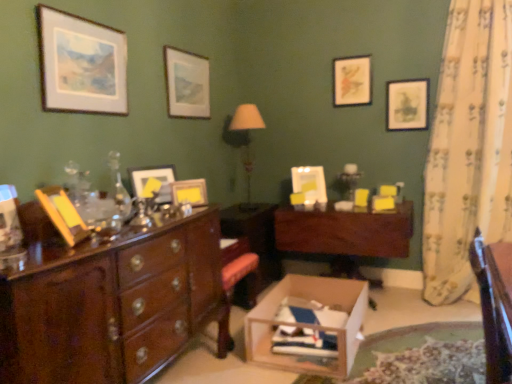
Question: From a real-world perspective, is mahogany wood desk at center positioned above or below matte gold picture frame at center, which is the fourth picture frame in left-to-right order?

Choices:
 (A) below
 (B) above

Answer: (A)

Question: Considering the positions of mahogany wood desk at center and matte gold picture frame at center, the second picture frame in the front-to-back sequence, in the image, is mahogany wood desk at center wider or thinner than matte gold picture frame at center, the second picture frame in the front-to-back sequence,?

Choices:
 (A) thin
 (B) wide

Answer: (B)

Question: Which object is positioned closest to the matte gold picture frame at center, the second picture frame in the front-to-back sequence?

Choices:
 (A) mahogany wood desk at center
 (B) matte black picture frame at upper right, positioned as the 6th picture frame in left-to-right order
 (C) wooden cardboard box at center
 (D) matte white picture frame at upper left, which is counted as the 6th picture frame, starting from the back
 (E) white floral fabric curtain at right

Answer: (D)

Question: Based on their relative distances, which object is nearer to the matte white picture frame at upper left, which appears as the first picture frame when viewed from the front?

Choices:
 (A) mahogany wood desk at center
 (B) white fabric lampshade at center
 (C) wooden cardboard box at center
 (D) yellow paper at center, the second picture frame from the left
 (E) matte gold picture frame at upper right, placed as the 5th picture frame when sorted from left to right

Answer: (D)